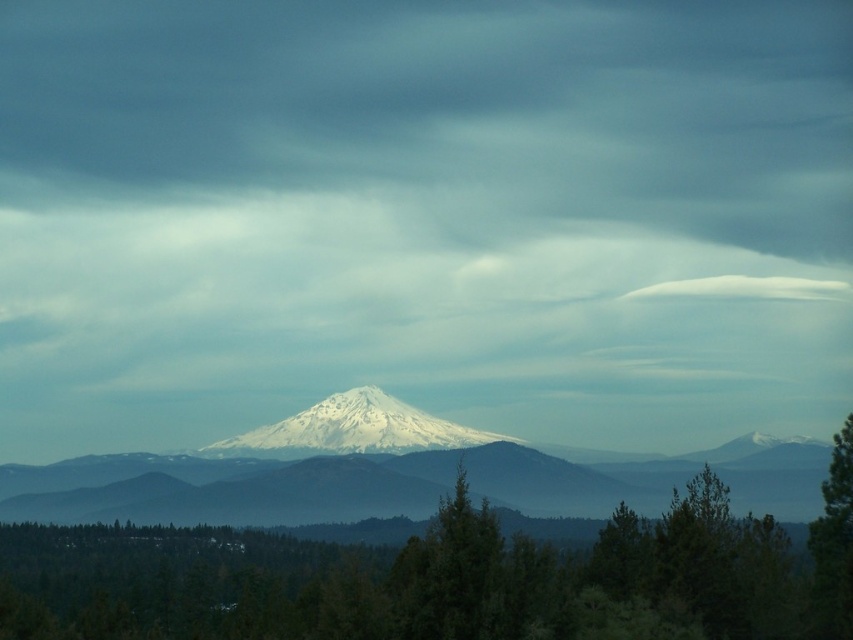
Question: From the image, what is the correct spatial relationship of snowy peak at center in relation to green matte tree at right?

Choices:
 (A) below
 (B) above

Answer: (B)

Question: Which of the following is the farthest from the observer?

Choices:
 (A) (204, 452)
 (B) (131, 612)
 (C) (849, 477)

Answer: (A)

Question: Which point is closer to the camera?

Choices:
 (A) (531, 593)
 (B) (268, 449)

Answer: (A)

Question: In this image, where is green matte tree at center located relative to green matte tree at right?

Choices:
 (A) above
 (B) below

Answer: (B)

Question: Which of these objects is positioned closest to the green matte tree at center?

Choices:
 (A) snowy peak at center
 (B) green matte tree at right

Answer: (B)

Question: Is snowy peak at center thinner than green matte tree at right?

Choices:
 (A) yes
 (B) no

Answer: (B)